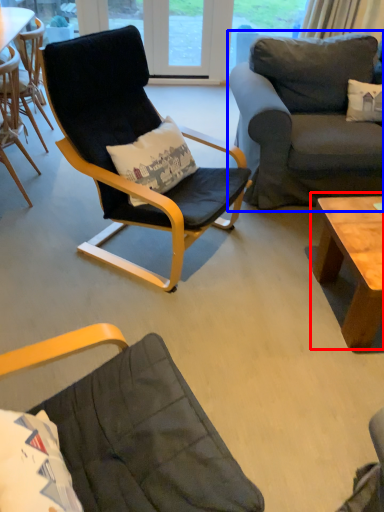
Question: Which object is further to the camera taking this photo, coffee table (highlighted by a red box) or studio couch (highlighted by a blue box)?

Choices:
 (A) coffee table
 (B) studio couch

Answer: (B)